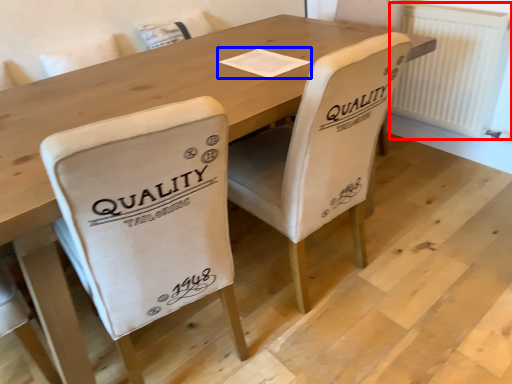
Question: Which object appears closest to the camera in this image, radiator (highlighted by a red box) or paper (highlighted by a blue box)?

Choices:
 (A) radiator
 (B) paper

Answer: (B)